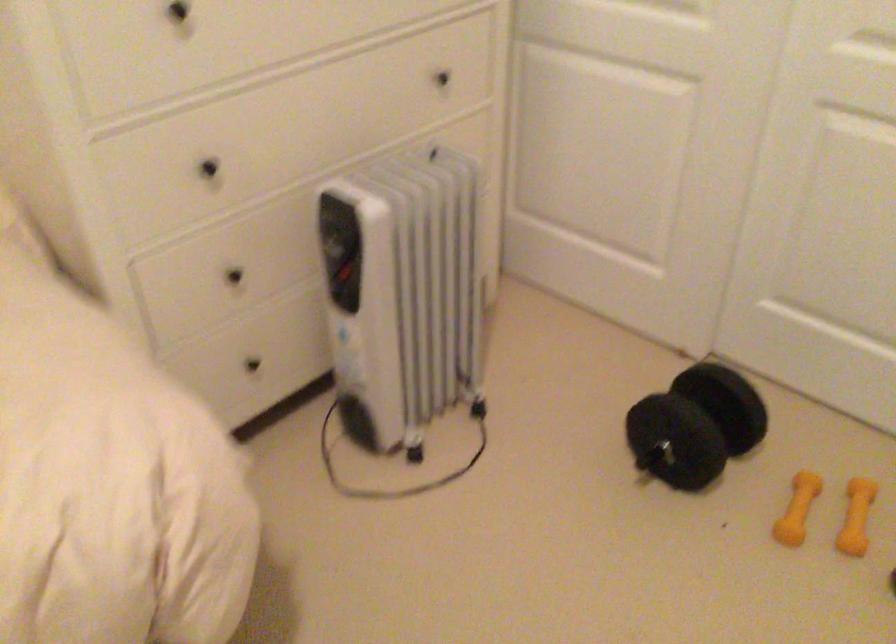
This screenshot has height=644, width=896. Describe the element at coordinates (340, 250) in the screenshot. I see `the heater control dial` at that location.